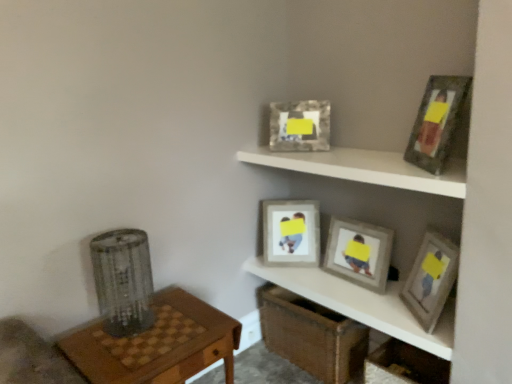
At what (x,y) coordinates should I click in order to perform the action: click on free space above matte gray picture frame at upper right, which appears as the fourth picture frame when viewed from the back (from a real-world perspective). Please return your answer as a coordinate pair (x, y). This screenshot has width=512, height=384. Looking at the image, I should click on (441, 240).